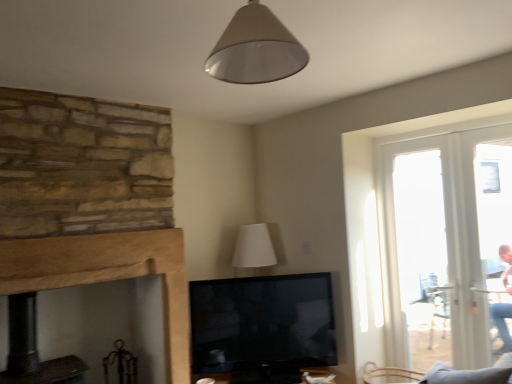
This screenshot has width=512, height=384. What do you see at coordinates (255, 49) in the screenshot?
I see `matte beige cone at upper center` at bounding box center [255, 49].

Identify the location of matte beige cone at upper center. click(x=255, y=49).

Image resolution: width=512 pixels, height=384 pixels. Describe the element at coordinates (90, 201) in the screenshot. I see `wooden mantle at center` at that location.

Where is `wooden mantle at center`? The image size is (512, 384). wooden mantle at center is located at coordinates (90, 201).

Where is `matte beige cone at upper center`? matte beige cone at upper center is located at coordinates (255, 49).

Based on their positions, is matte beige cone at upper center located to the left or right of wooden mantle at center?

In the image, matte beige cone at upper center appears on the right side of wooden mantle at center.

Is matte beige cone at upper center further to camera compared to wooden mantle at center?

No.

Which is nearer, (265, 17) or (111, 203)?

The point (265, 17) is in front.

From the image's perspective, which is below, matte beige cone at upper center or wooden mantle at center?

wooden mantle at center appears lower in the image.

From a real-world perspective, is matte beige cone at upper center physically below wooden mantle at center?

No, from a real-world perspective, matte beige cone at upper center is not under wooden mantle at center.

Which object is wider, matte beige cone at upper center or wooden mantle at center?

matte beige cone at upper center is wider.

Considering the relative sizes of matte beige cone at upper center and wooden mantle at center in the image provided, is matte beige cone at upper center shorter than wooden mantle at center?

Correct, matte beige cone at upper center is not as tall as wooden mantle at center.

In the scene shown: Considering the sizes of objects matte beige cone at upper center and wooden mantle at center in the image provided, who is smaller, matte beige cone at upper center or wooden mantle at center?

With smaller size is matte beige cone at upper center.

Which is correct: matte beige cone at upper center is inside wooden mantle at center, or outside of it?

matte beige cone at upper center is spatially situated outside wooden mantle at center.

Is matte beige cone at upper center beside wooden mantle at center?

No, matte beige cone at upper center is not beside wooden mantle at center.

Is matte beige cone at upper center facing away from wooden mantle at center?

No, matte beige cone at upper center's orientation is not away from wooden mantle at center.

What's the angular difference between matte beige cone at upper center and wooden mantle at center's facing directions?

They differ by 81.8 degrees in their facing directions.

Where is `lamp above the wooden mantle at center (from the image's perspective)`? This screenshot has width=512, height=384. lamp above the wooden mantle at center (from the image's perspective) is located at coordinates (255, 49).

Based on their positions, is wooden mantle at center located to the left or right of matte beige cone at upper center?

wooden mantle at center is positioned on matte beige cone at upper center's left side.

Which object is closer to the camera taking this photo, wooden mantle at center or matte beige cone at upper center?

matte beige cone at upper center is in front.

Considering the points (11, 278) and (228, 32), which point is in front, point (11, 278) or point (228, 32)?

The point (228, 32) is closer to the camera.

From the image's perspective, is wooden mantle at center above or below matte beige cone at upper center?

Based on their image positions, wooden mantle at center is located beneath matte beige cone at upper center.

From a real-world perspective, which is physically below, wooden mantle at center or matte beige cone at upper center?

From a 3D spatial view, wooden mantle at center is below.

Between wooden mantle at center and matte beige cone at upper center, which one has larger width?

Wider between the two is matte beige cone at upper center.

Between wooden mantle at center and matte beige cone at upper center, which one has less height?

matte beige cone at upper center.

Which of these two, wooden mantle at center or matte beige cone at upper center, is bigger?

With larger size is wooden mantle at center.

Is wooden mantle at center situated inside matte beige cone at upper center or outside?

wooden mantle at center is outside matte beige cone at upper center.

Is wooden mantle at center next to matte beige cone at upper center and touching it?

There is a gap between wooden mantle at center and matte beige cone at upper center.

Does wooden mantle at center turn towards matte beige cone at upper center?

No, wooden mantle at center is not oriented towards matte beige cone at upper center.

How many degrees apart are the facing directions of wooden mantle at center and matte beige cone at upper center?

81.8 degrees.

What are the coordinates of `lamp on the right side of wooden mantle at center` in the screenshot? It's located at (255, 49).

This screenshot has width=512, height=384. In order to click on lamp above the wooden mantle at center (from a real-world perspective) in this screenshot , I will do `click(255, 49)`.

Locate an element on the screen. lamp on the right of the wooden mantle at center is located at coordinates (255, 49).